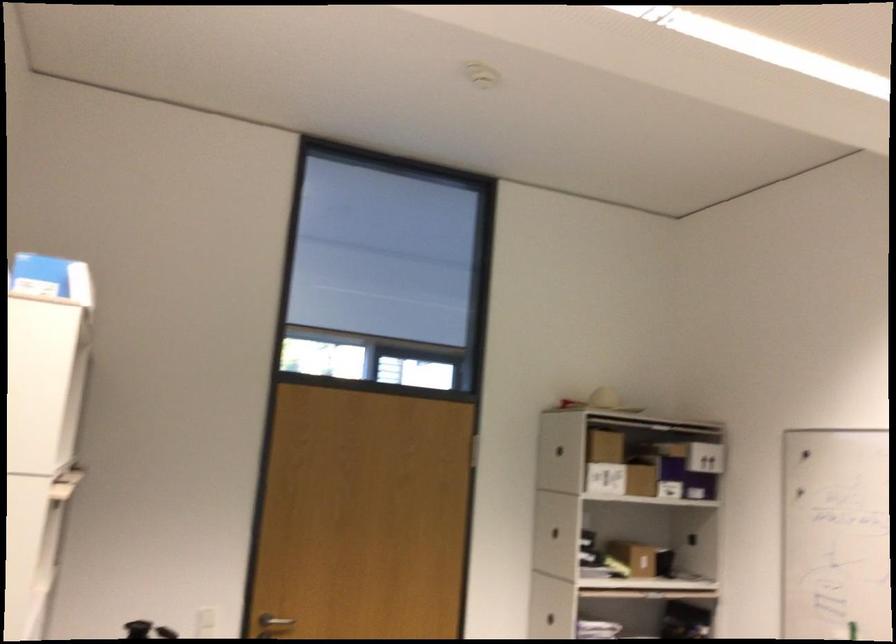
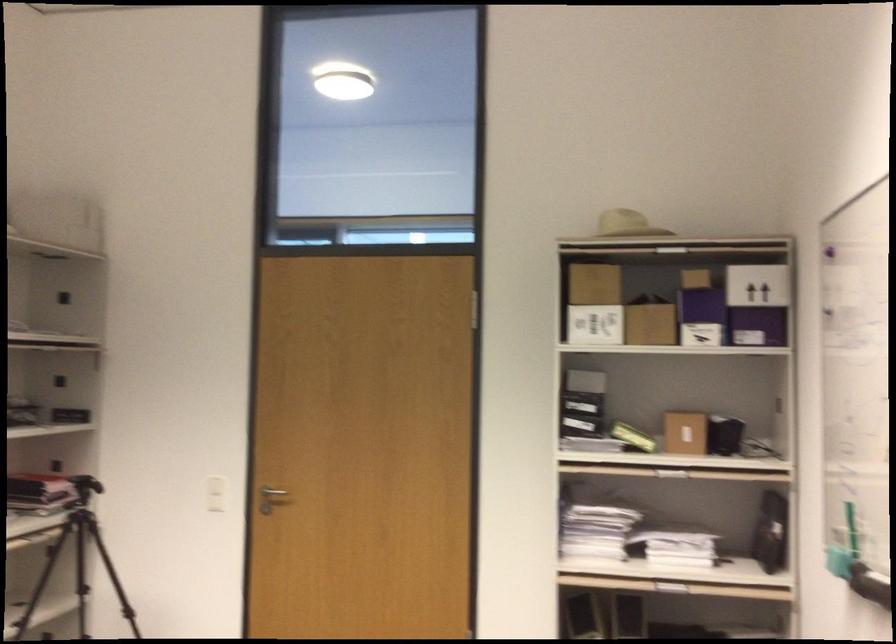
The point at (602, 397) is marked in the first image. Where is the corresponding point in the second image?

(626, 223)